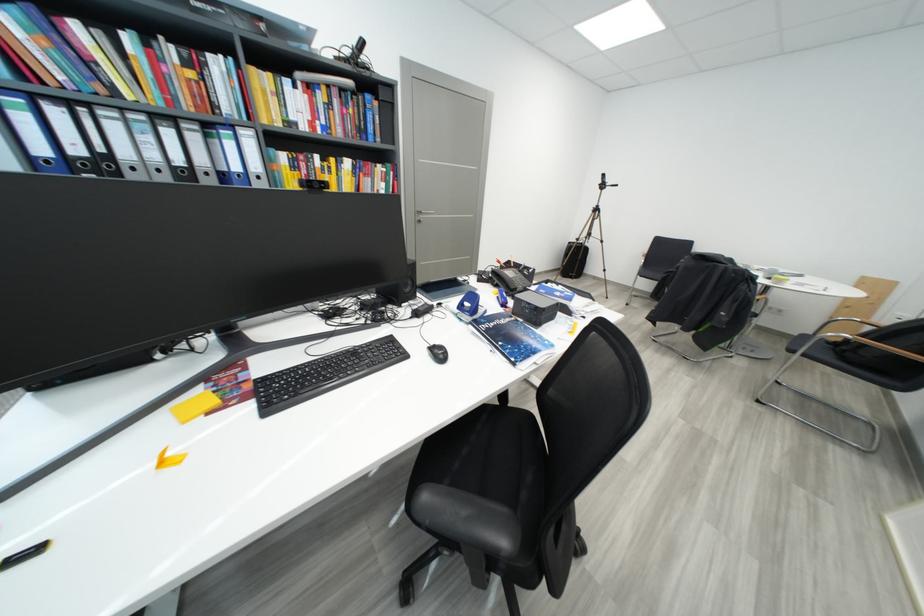
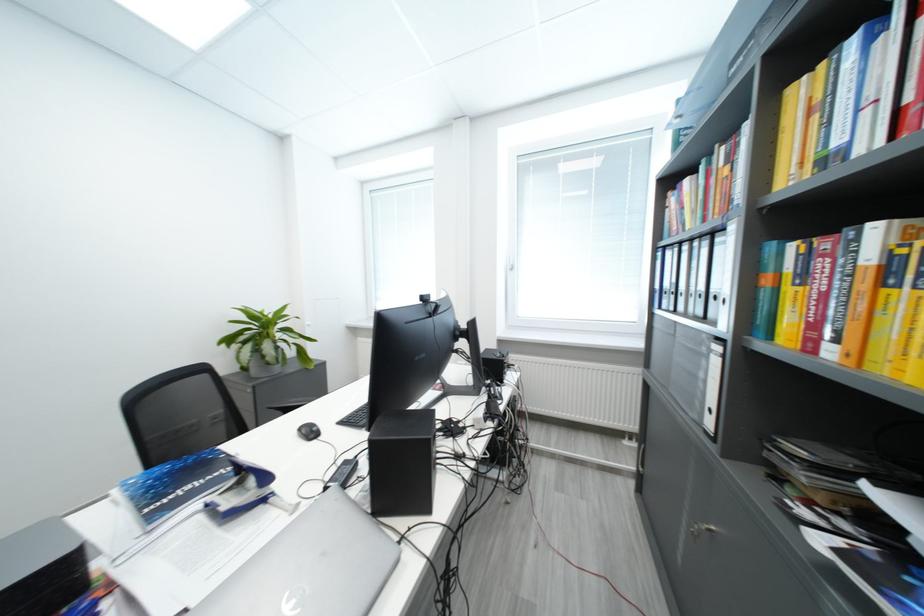
Where in the second image is the point corresponding to (x=84, y=28) from the first image?

(696, 184)